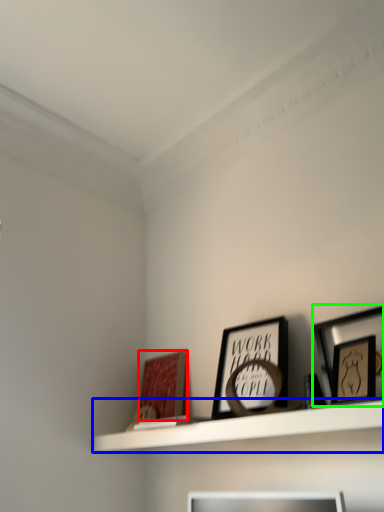
Question: Based on their relative distances, which object is nearer to picture frame (highlighted by a red box)? Choose from shelf (highlighted by a blue box) and picture frame (highlighted by a green box).

Choices:
 (A) shelf
 (B) picture frame

Answer: (A)